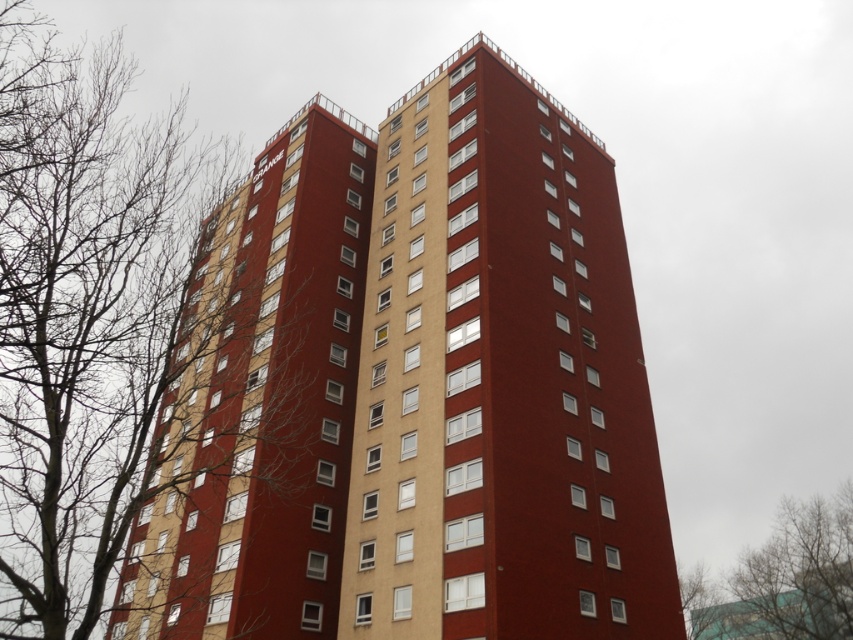
Question: Is the position of bare branches at left less distant than that of bare branches at upper left?

Choices:
 (A) no
 (B) yes

Answer: (B)

Question: Can you confirm if bare branches at left is positioned above bare branches at upper left?

Choices:
 (A) no
 (B) yes

Answer: (B)

Question: Among these objects, which one is farthest from the camera?

Choices:
 (A) bare branches at upper left
 (B) bare branches at left

Answer: (A)

Question: Which point appears closest to the camera in this image?

Choices:
 (A) (33, 99)
 (B) (576, 353)
 (C) (844, 496)

Answer: (A)

Question: Is smooth brick building at center positioned at the back of bare branches at left?

Choices:
 (A) yes
 (B) no

Answer: (A)

Question: Which point appears closest to the camera in this image?

Choices:
 (A) (3, 228)
 (B) (616, 627)
 (C) (792, 621)

Answer: (A)